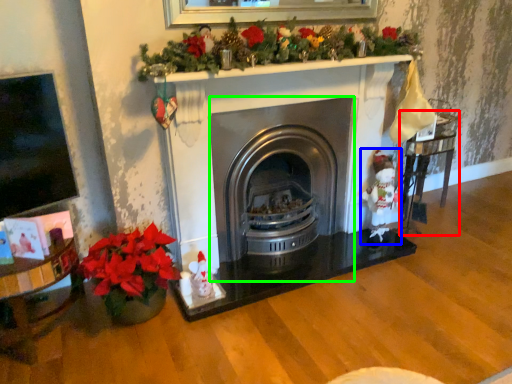
Question: Which object is the closest to the table (highlighted by a red box)? Choose among these: santa claus (highlighted by a blue box) or wood burning stove (highlighted by a green box).

Choices:
 (A) santa claus
 (B) wood burning stove

Answer: (A)